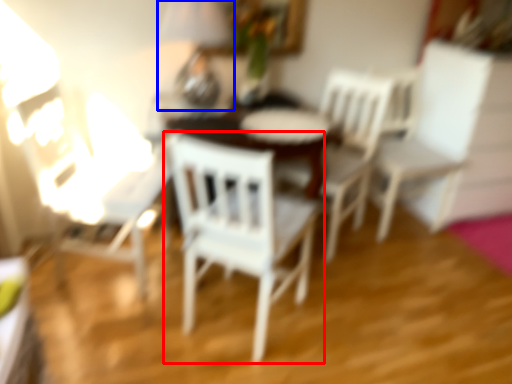
Question: Which point is closer to the camera, chair (highlighted by a red box) or table lamp (highlighted by a blue box)?

Choices:
 (A) chair
 (B) table lamp

Answer: (A)